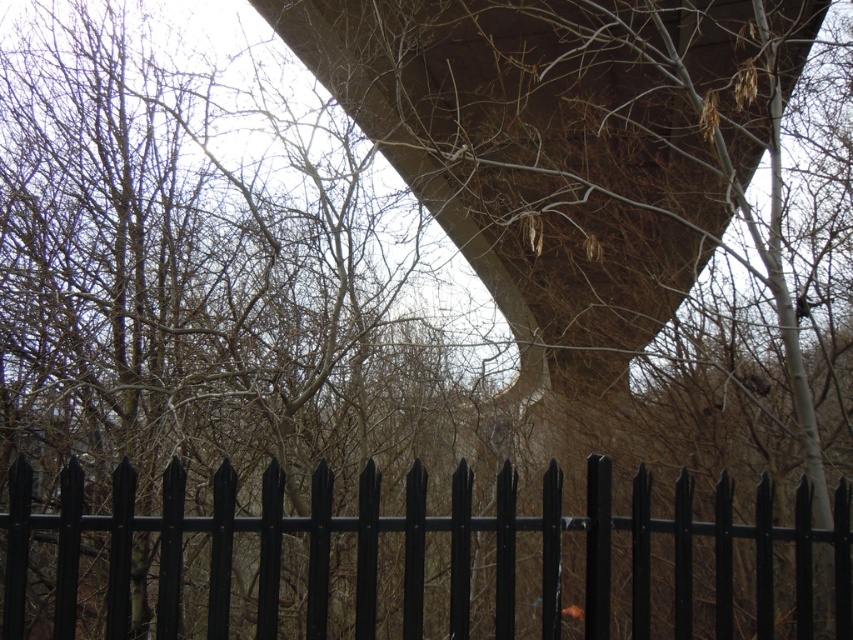
Can you confirm if brown/dry branches at upper center is positioned to the right of black metal fence at lower center?

In fact, brown/dry branches at upper center is to the left of black metal fence at lower center.

Who is more forward, (259, 266) or (310, 548)?

Point (310, 548)

You are a GUI agent. You are given a task and a screenshot of the screen. Output one action in this format:
    pyautogui.click(x=<x>, y=<y>)
    Task: Click on the brown/dry branches at upper center
    The width and height of the screenshot is (853, 640).
    Given the screenshot: What is the action you would take?
    pyautogui.click(x=202, y=268)

Identify the location of brown/dry branches at upper center. (202, 268).